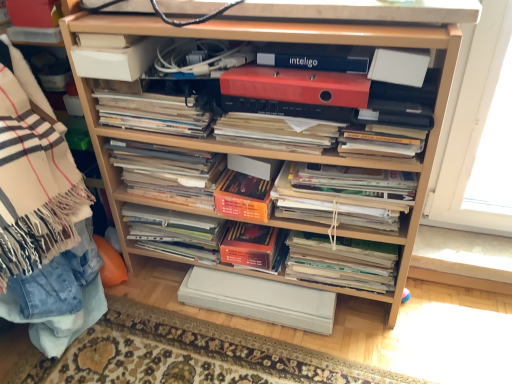
Identify the location of blank space situated above orange matte paperback book at center, which is the 6th paperback book in top-to-bottom order (from a real-world perspective). (252, 237).